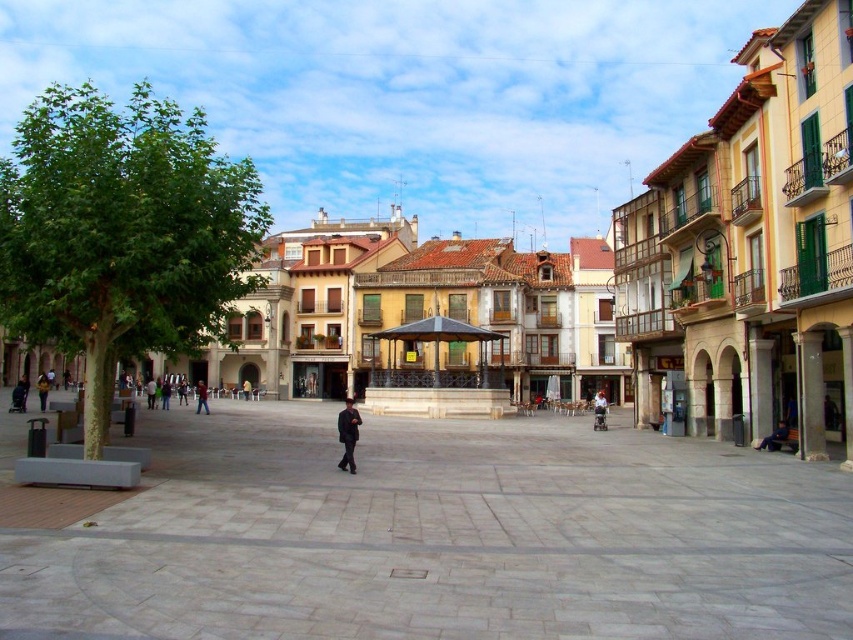
Question: Which point is farther to the camera?

Choices:
 (A) dark brown leather jacket at lower left
 (B) dark blue jeans at lower right
 (C) white fabric umbrella at center

Answer: (C)

Question: Which point is closer to the camera?

Choices:
 (A) white fabric umbrella at center
 (B) smooth stone square at center
 (C) dark blue jeans at lower right
 (D) dark blue suit at center

Answer: (B)

Question: Which point is farther from the camera taking this photo?

Choices:
 (A) (350, 461)
 (B) (45, 388)

Answer: (B)

Question: Does dark blue jeans at lower right have a lesser width compared to smooth stone square at center?

Choices:
 (A) no
 (B) yes

Answer: (A)

Question: Is smooth concrete plaza at center to the left of dark blue suit at center from the viewer's perspective?

Choices:
 (A) yes
 (B) no

Answer: (B)

Question: Can you confirm if smooth concrete plaza at center is smaller than white fabric umbrella at center?

Choices:
 (A) no
 (B) yes

Answer: (A)